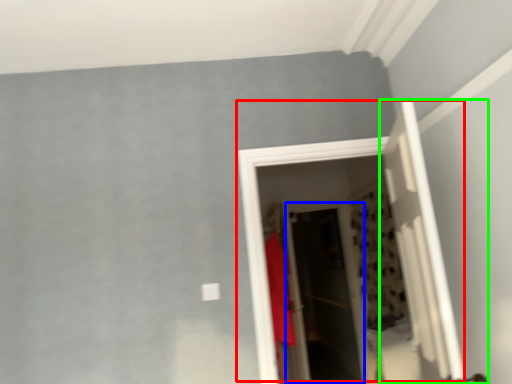
Question: Based on their relative distances, which object is farther from door (highlighted by a red box)? Choose from screen door (highlighted by a blue box) and door (highlighted by a green box).

Choices:
 (A) screen door
 (B) door

Answer: (A)